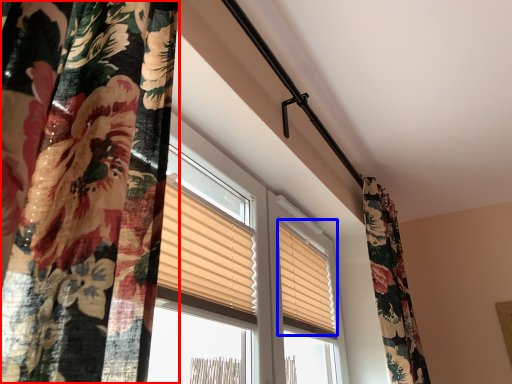
Question: Which of the following is the closest to the observer, curtain (highlighted by a red box) or window blind (highlighted by a blue box)?

Choices:
 (A) curtain
 (B) window blind

Answer: (A)